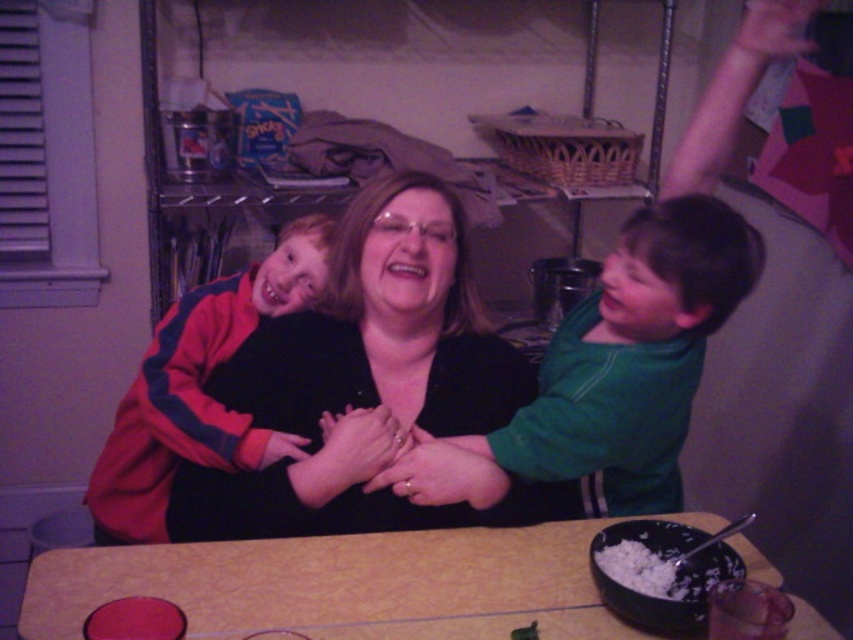
Which of these two, black matte sweater at center or yellow textured table at center, stands taller?

black matte sweater at center is taller.

Who is more distant from viewer, (257, 381) or (383, 582)?

Point (257, 381)

Locate an element on the screen. This screenshot has width=853, height=640. black matte sweater at center is located at coordinates (363, 380).

Between yellow textured table at center and green matte shirt at center, which one appears on the left side from the viewer's perspective?

yellow textured table at center is more to the left.

Does yellow textured table at center have a smaller size compared to green matte shirt at center?

Yes, yellow textured table at center is smaller than green matte shirt at center.

Does point (434, 540) lie in front of point (701, 284)?

That is False.

This screenshot has width=853, height=640. I want to click on yellow textured table at center, so click(341, 586).

Is black matte sweater at center wider than white matte rice bowl at lower center?

Indeed, black matte sweater at center has a greater width compared to white matte rice bowl at lower center.

How far apart are black matte sweater at center and white matte rice bowl at lower center?

The distance of black matte sweater at center from white matte rice bowl at lower center is 16.76 inches.

Is point (390, 524) positioned before point (592, 564)?

No, (390, 524) is behind (592, 564).

Identify the location of black matte sweater at center. This screenshot has height=640, width=853. (363, 380).